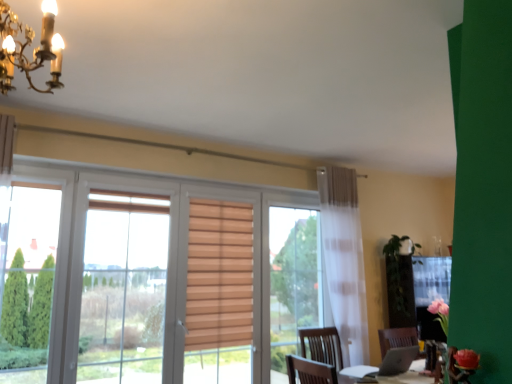
What do you see at coordinates (27, 45) in the screenshot?
I see `gold metallic chandelier at upper left` at bounding box center [27, 45].

Locate an element on the screen. The width and height of the screenshot is (512, 384). gold metallic chandelier at upper left is located at coordinates (27, 45).

What do you see at coordinates (400, 283) in the screenshot? I see `green matte plant at right` at bounding box center [400, 283].

Find the location of a particular element. green matte plant at right is located at coordinates (400, 283).

This screenshot has height=384, width=512. In order to click on gold metallic chandelier at upper left in this screenshot , I will do `click(27, 45)`.

Is green matte plant at right to the left or to the right of gold metallic chandelier at upper left in the image?

Clearly, green matte plant at right is on the right of gold metallic chandelier at upper left in the image.

Does green matte plant at right lie in front of gold metallic chandelier at upper left?

No, it is not.

Is point (391, 277) closer or farther from the camera than point (5, 72)?

Point (391, 277).

From the image's perspective, which one is positioned higher, green matte plant at right or gold metallic chandelier at upper left?

gold metallic chandelier at upper left is shown above in the image.

From a real-world perspective, who is located higher, green matte plant at right or gold metallic chandelier at upper left?

gold metallic chandelier at upper left is physically above.

Considering the sizes of objects green matte plant at right and gold metallic chandelier at upper left in the image provided, who is wider, green matte plant at right or gold metallic chandelier at upper left?

With larger width is green matte plant at right.

Which of these two, green matte plant at right or gold metallic chandelier at upper left, stands shorter?

With less height is gold metallic chandelier at upper left.

In the scene shown: Considering the sizes of green matte plant at right and gold metallic chandelier at upper left in the image, is green matte plant at right bigger or smaller than gold metallic chandelier at upper left?

Clearly, green matte plant at right is larger in size than gold metallic chandelier at upper left.

Can gold metallic chandelier at upper left be found inside green matte plant at right?

No, gold metallic chandelier at upper left is not surrounded by green matte plant at right.

Is the surface of green matte plant at right in direct contact with gold metallic chandelier at upper left?

No, green matte plant at right is not with gold metallic chandelier at upper left.

Is green matte plant at right aimed at gold metallic chandelier at upper left?

No.

Measure the distance between green matte plant at right and gold metallic chandelier at upper left.

green matte plant at right is 3.96 meters away from gold metallic chandelier at upper left.

Image resolution: width=512 pixels, height=384 pixels. Identify the location of plant lying below the gold metallic chandelier at upper left (from the image's perspective). (400, 283).

Which object is positioned more to the left, gold metallic chandelier at upper left or green matte plant at right?

Positioned to the left is gold metallic chandelier at upper left.

Between gold metallic chandelier at upper left and green matte plant at right, which one is positioned behind?

green matte plant at right is more distant.

Considering the positions of point (4, 60) and point (419, 247), is point (4, 60) closer or farther from the camera than point (419, 247)?

Point (4, 60).

From the image's perspective, does gold metallic chandelier at upper left appear lower than green matte plant at right?

Incorrect, from the image's perspective, gold metallic chandelier at upper left is higher than green matte plant at right.

From a real-world perspective, which is physically below, gold metallic chandelier at upper left or green matte plant at right?

green matte plant at right.

From the picture: Is gold metallic chandelier at upper left wider than green matte plant at right?

In fact, gold metallic chandelier at upper left might be narrower than green matte plant at right.

Considering the sizes of objects gold metallic chandelier at upper left and green matte plant at right in the image provided, who is shorter, gold metallic chandelier at upper left or green matte plant at right?

gold metallic chandelier at upper left is shorter.

Can you confirm if gold metallic chandelier at upper left is smaller than green matte plant at right?

Indeed, gold metallic chandelier at upper left has a smaller size compared to green matte plant at right.

Is gold metallic chandelier at upper left inside the boundaries of green matte plant at right, or outside?

gold metallic chandelier at upper left is located beyond the bounds of green matte plant at right.

From the picture: Are gold metallic chandelier at upper left and green matte plant at right making contact?

gold metallic chandelier at upper left is not next to green matte plant at right, and they're not touching.

Does gold metallic chandelier at upper left turn towards green matte plant at right?

No, gold metallic chandelier at upper left is not turned towards green matte plant at right.

What's the angular difference between gold metallic chandelier at upper left and green matte plant at right's facing directions?

They differ by 90.1 degrees in their facing directions.

At what (x,y) coordinates should I click in order to perform the action: click on plant that is behind the gold metallic chandelier at upper left. Please return your answer as a coordinate pair (x, y). Looking at the image, I should click on (400, 283).

Locate an element on the screen. plant that is below the gold metallic chandelier at upper left (from the image's perspective) is located at coordinates (400, 283).

Where is `light fixture above the green matte plant at right (from the image's perspective)`? Image resolution: width=512 pixels, height=384 pixels. light fixture above the green matte plant at right (from the image's perspective) is located at coordinates (27, 45).